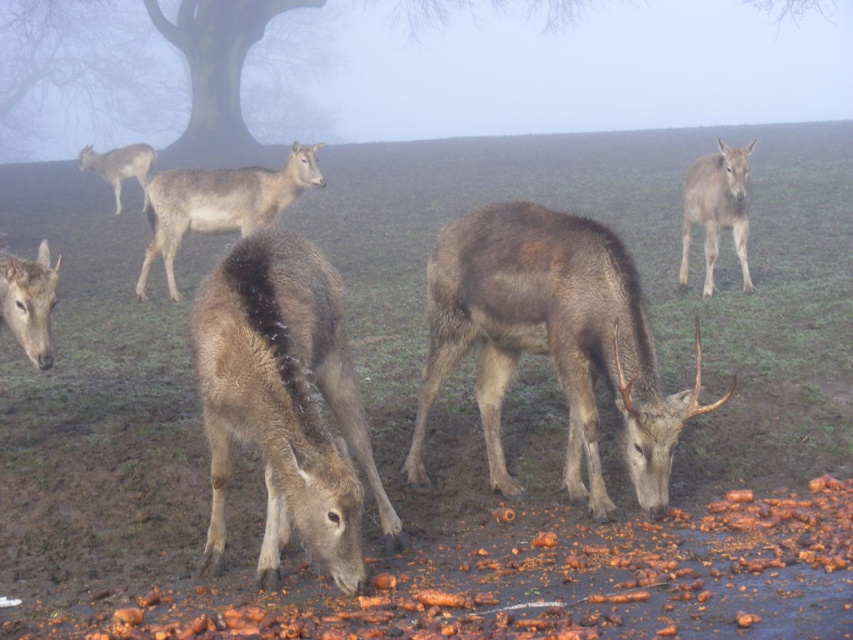
You are a wildlife photographer aiming to capture both the brown fur deer at center and the gray matte deer at center in a single frame. Based on their positions, which deer would appear closer to the camera in your photo?

The brown fur deer at center is located below the gray matte deer at center, so in the photo, the brown fur deer at center would appear closer to the camera since it is positioned lower in the frame.

You are a photographer standing at the edge of the field. You want to take a photo that includes both the gray matte deer at center and the brown fur deer at lower left. The camera you have can focus on subjects within a 5 meter range. Will both deer be in focus?

The gray matte deer at center is 4.43 meters away from brown fur deer at lower left. Since the camera can focus within 5 meters, both deer will be in focus as their distance apart is within the camera range.